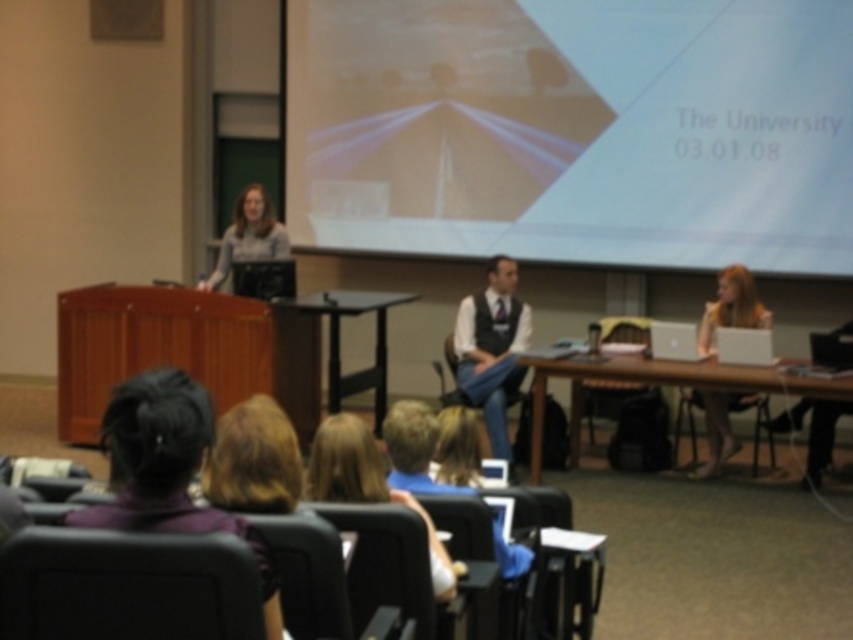
You are standing at the back of the lecture hall and want to hand a document to the person with blonde hair at center and the person with the matte white laptop at right. If you can walk 1 foot per second, how many seconds will it take you to reach both individuals if you go to them one after the other?

The blonde hair at center is 14.04 feet away from the matte white laptop at right. Since you need to go to both individuals one after the other, the total distance is 14.04 feet. At a speed of 1 foot per second, it will take 14.04 seconds to reach both individuals.

You are an attendee at the university lecture. You want to take a photo of the presenter at the podium but need to ensure your phone won not block the view of the dark brown hair at lower left and the matte white laptop at right. Which object should you avoid covering in your photo?

You should avoid covering the dark brown hair at lower left in your photo because it is located below the matte white laptop at right, so obscuring the laptop might still allow visibility of the hair, but covering the hair would block its view entirely.

You are organizing a tech conference and need to place a new laptop that is 14 inches wide on the stage. The matte white laptop at right and the silver metallic laptop at center are already there. Based on their widths, can you determine if the new laptop will fit between them without overlapping?

The matte white laptop at right might be wider than silver metallic laptop at center. Since the exact width difference isn not specified, it is uncertain whether the new 14 inch laptop will fit between them without overlapping. Check the actual dimensions first.